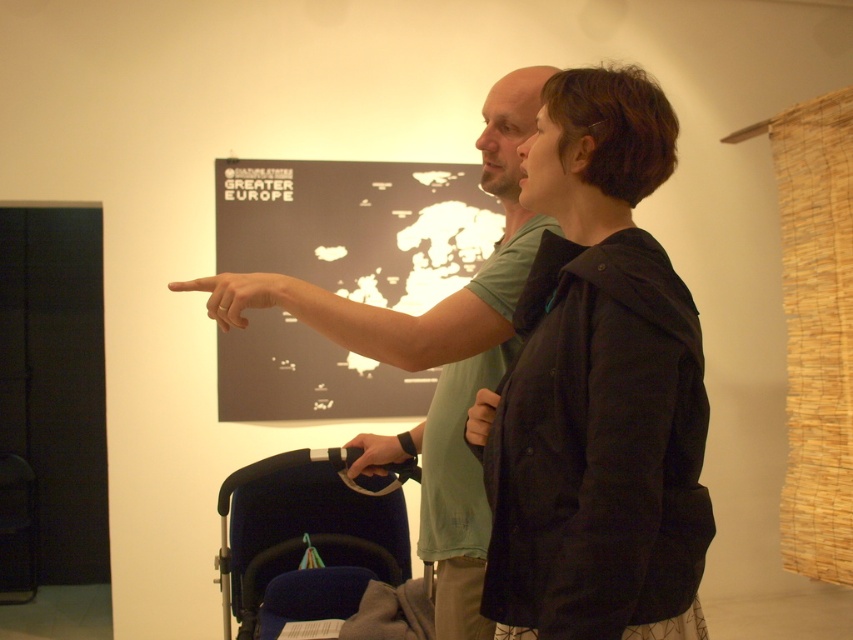
Which is above, green matte t-shirt at center or smooth skin finger at center?

smooth skin finger at center is above.

I want to click on green matte t-shirt at center, so click(457, 358).

Is matte black map at center to the right of smooth black hand at center from the viewer's perspective?

In fact, matte black map at center is to the left of smooth black hand at center.

Which is in front, point (276, 419) or point (485, 397)?

Positioned in front is point (485, 397).

At what (x,y) coordinates should I click in order to perform the action: click on matte black map at center. Please return your answer as a coordinate pair (x, y). Looking at the image, I should click on (357, 225).

Does velvet blue baby carriage at lower left have a smaller size compared to matte black hand at center?

Incorrect, velvet blue baby carriage at lower left is not smaller in size than matte black hand at center.

Can you confirm if velvet blue baby carriage at lower left is positioned to the left of matte black hand at center?

Correct, you'll find velvet blue baby carriage at lower left to the left of matte black hand at center.

Between point (386, 573) and point (381, 458), which one is positioned in front?

Point (381, 458)

Image resolution: width=853 pixels, height=640 pixels. I want to click on velvet blue baby carriage at lower left, so click(303, 540).